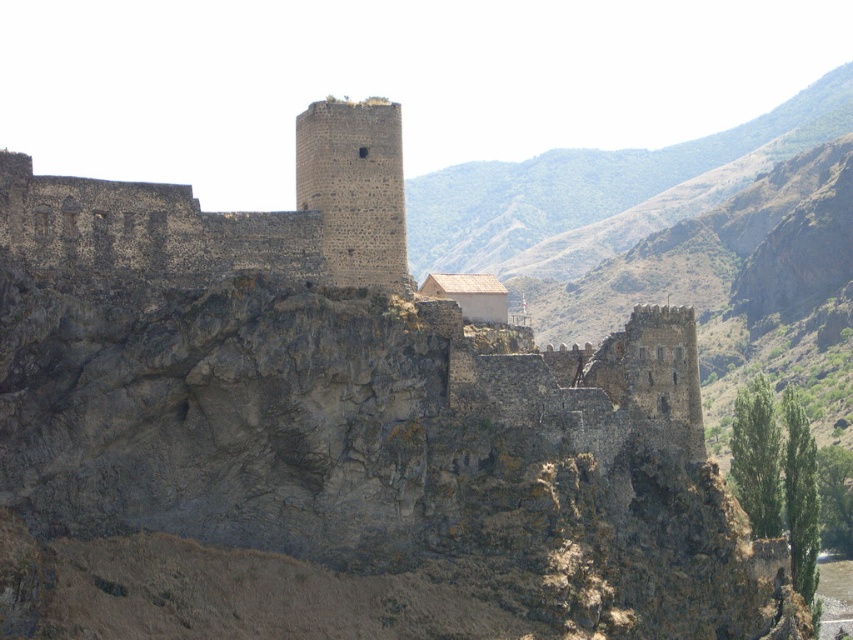
Question: Does dark stone tower at upper center appear over dark gray stone tower at center?

Choices:
 (A) no
 (B) yes

Answer: (A)

Question: Among these points, which one is nearest to the camera?

Choices:
 (A) (401, 177)
 (B) (321, 132)

Answer: (B)

Question: Where is dark stone tower at upper center located in relation to dark gray stone tower at center in the image?

Choices:
 (A) left
 (B) right

Answer: (A)

Question: Can you confirm if dark stone tower at upper center is positioned above dark gray stone tower at center?

Choices:
 (A) yes
 (B) no

Answer: (B)

Question: Which point is closer to the camera?

Choices:
 (A) (399, 237)
 (B) (144, 204)

Answer: (B)